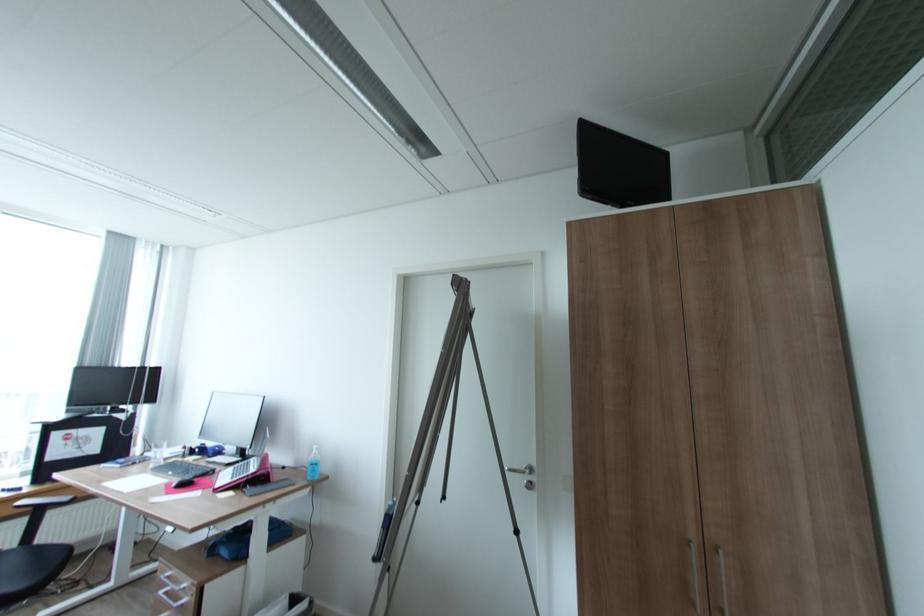
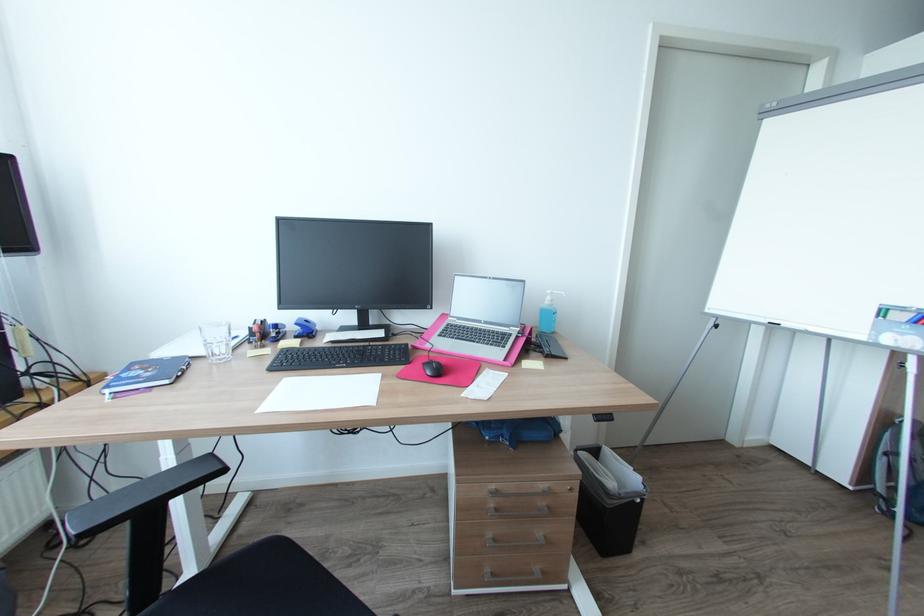
Question: I am providing you with two images of the same scene from different viewpoints. Which of the following objects are not visible in image2?

Choices:
 (A) red whiteboard marker
 (B) blue stapler
 (C) chair sitting surface
 (D) none of these

Answer: (D)